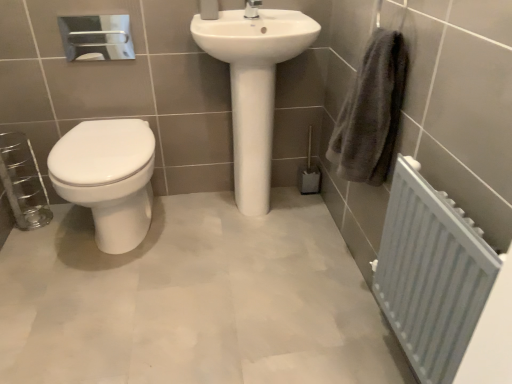
Image resolution: width=512 pixels, height=384 pixels. Describe the element at coordinates (108, 178) in the screenshot. I see `white glossy toilet at left` at that location.

At what (x,y) coordinates should I click in order to perform the action: click on polished chrome tap at upper center. Please return your answer as a coordinate pair (x, y). Image resolution: width=512 pixels, height=384 pixels. Looking at the image, I should click on (252, 9).

The image size is (512, 384). What are the coordinates of `gray cotton towel at right` in the screenshot? It's located at (371, 112).

Locate an element on the screen. The width and height of the screenshot is (512, 384). white glossy sink at center is located at coordinates (253, 85).

Identify the location of white glossy toilet at left. The height and width of the screenshot is (384, 512). (108, 178).

Is white painted metal radiator at lower right facing towards white glossy sink at center?

No, white painted metal radiator at lower right does not turn towards white glossy sink at center.

From a real-world perspective, is white painted metal radiator at lower right physically above white glossy sink at center?

Incorrect, from a real-world perspective, white painted metal radiator at lower right is lower than white glossy sink at center.

How many degrees apart are the facing directions of white painted metal radiator at lower right and white glossy sink at center?

The facing directions of white painted metal radiator at lower right and white glossy sink at center are 88.9 degrees apart.

Which of these two, white painted metal radiator at lower right or white glossy sink at center, is smaller?

white painted metal radiator at lower right.

Would you say gray cotton towel at right is outside polished chrome tap at upper center?

Yes, gray cotton towel at right is not within polished chrome tap at upper center.

Is gray cotton towel at right positioned with its back to polished chrome tap at upper center?

No, gray cotton towel at right's orientation is not away from polished chrome tap at upper center.

How different are the orientations of gray cotton towel at right and polished chrome tap at upper center in degrees?

They differ by 88.5 degrees in their facing directions.

Between gray cotton towel at right and polished chrome tap at upper center, which one has larger size?

gray cotton towel at right is bigger.

Consider the image. Is white glossy sink at center placed right next to polished chrome tap at upper center?

No, white glossy sink at center is not with polished chrome tap at upper center.

Is the position of white glossy sink at center less distant than that of polished chrome tap at upper center?

Yes, it is.

Is white glossy sink at center oriented away from polished chrome tap at upper center?

That's not correct — white glossy sink at center is not looking away from polished chrome tap at upper center.

Is gray cotton towel at right to the right of white painted metal radiator at lower right from the viewer's perspective?

No.

Based on their sizes in the image, would you say gray cotton towel at right is bigger or smaller than white painted metal radiator at lower right?

gray cotton towel at right is smaller than white painted metal radiator at lower right.

Does gray cotton towel at right turn towards white painted metal radiator at lower right?

No, gray cotton towel at right does not turn towards white painted metal radiator at lower right.

Is gray cotton towel at right wider than white painted metal radiator at lower right?

Yes.

Which of these two, white glossy sink at center or gray cotton towel at right, stands shorter?

With less height is gray cotton towel at right.

Considering the relative positions of white glossy sink at center and gray cotton towel at right in the image provided, is white glossy sink at center to the left or to the right of gray cotton towel at right?

white glossy sink at center is positioned on gray cotton towel at right's left side.

From the image's perspective, who appears lower, white glossy sink at center or gray cotton towel at right?

gray cotton towel at right.

The height and width of the screenshot is (384, 512). I want to click on sink that is above the gray cotton towel at right (from the image's perspective), so click(x=253, y=85).

Can you confirm if polished chrome tap at upper center is taller than gray cotton towel at right?

In fact, polished chrome tap at upper center may be shorter than gray cotton towel at right.

Is polished chrome tap at upper center aimed at gray cotton towel at right?

No, polished chrome tap at upper center is not oriented towards gray cotton towel at right.

Locate an element on the screen. The image size is (512, 384). tap above the gray cotton towel at right (from the image's perspective) is located at coordinates (252, 9).

From the picture: Is gray cotton towel at right a part of polished chrome tap at upper center?

No, polished chrome tap at upper center does not contain gray cotton towel at right.

Who is shorter, white glossy toilet at left or gray cotton towel at right?

With less height is white glossy toilet at left.

From the image's perspective, is white glossy toilet at left located above or below gray cotton towel at right?

white glossy toilet at left is situated lower than gray cotton towel at right in the image.

What's the angular difference between white glossy toilet at left and gray cotton towel at right's facing directions?

The angle between the facing direction of white glossy toilet at left and the facing direction of gray cotton towel at right is 88.5 degrees.

Between white glossy toilet at left and gray cotton towel at right, which one has smaller width?

Thinner between the two is gray cotton towel at right.

Image resolution: width=512 pixels, height=384 pixels. Find the location of `radiator lying below the white glossy sink at center (from the image's perspective)`. radiator lying below the white glossy sink at center (from the image's perspective) is located at coordinates (431, 274).

Where is `tap that appears behind the gray cotton towel at right`? The height and width of the screenshot is (384, 512). tap that appears behind the gray cotton towel at right is located at coordinates (252, 9).

Looking at the image, which one is located closer to polished chrome tap at upper center, white glossy toilet at left or gray cotton towel at right?

gray cotton towel at right is closer to polished chrome tap at upper center.

Based on their spatial positions, is white painted metal radiator at lower right or white glossy toilet at left further from polished chrome tap at upper center?

white painted metal radiator at lower right is positioned further to the anchor polished chrome tap at upper center.

From the image, which object appears to be nearer to white glossy sink at center, gray cotton towel at right or polished chrome tap at upper center?

The object closer to white glossy sink at center is polished chrome tap at upper center.

Which object lies nearer to the anchor point white painted metal radiator at lower right, white glossy sink at center or gray cotton towel at right?

gray cotton towel at right is positioned closer to the anchor white painted metal radiator at lower right.

Considering their positions, is polished chrome tap at upper center positioned closer to gray cotton towel at right than white glossy sink at center?

white glossy sink at center is closer to gray cotton towel at right.

Looking at this image, considering their positions, is white glossy sink at center positioned further to white glossy toilet at left than polished chrome tap at upper center?

polished chrome tap at upper center lies further to white glossy toilet at left than the other object.

Looking at the image, which one is located closer to white glossy sink at center, polished chrome tap at upper center or gray cotton towel at right?

Among the two, polished chrome tap at upper center is located nearer to white glossy sink at center.

From the picture: When comparing their distances from white glossy sink at center, does gray cotton towel at right or white glossy toilet at left seem closer?

gray cotton towel at right is closer to white glossy sink at center.

This screenshot has height=384, width=512. Identify the location of bath towel between polished chrome tap at upper center and white painted metal radiator at lower right in the vertical direction. (371, 112).

At what (x,y) coordinates should I click in order to perform the action: click on sink between white glossy toilet at left and gray cotton towel at right from left to right. Please return your answer as a coordinate pair (x, y). The height and width of the screenshot is (384, 512). Looking at the image, I should click on (253, 85).

At what (x,y) coordinates should I click in order to perform the action: click on tap between white glossy toilet at left and white painted metal radiator at lower right. Please return your answer as a coordinate pair (x, y). This screenshot has width=512, height=384. Looking at the image, I should click on (252, 9).

Where is `sink between polished chrome tap at upper center and white painted metal radiator at lower right from top to bottom`? This screenshot has height=384, width=512. sink between polished chrome tap at upper center and white painted metal radiator at lower right from top to bottom is located at coordinates (253, 85).